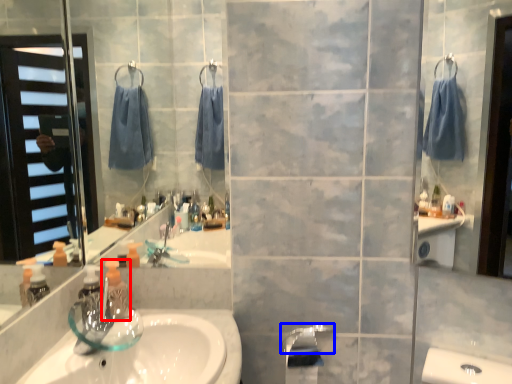
Question: Which point is closer to the camera, soap dispenser (highlighted by a red box) or faucet (highlighted by a blue box)?

Choices:
 (A) soap dispenser
 (B) faucet

Answer: (A)